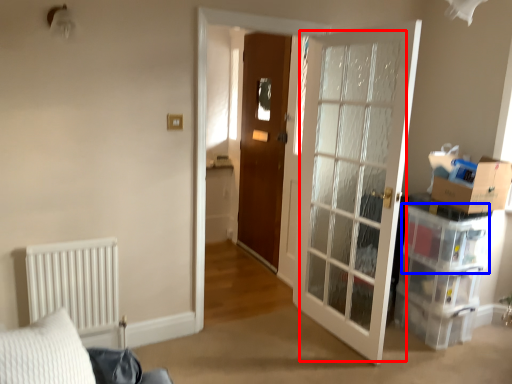
Question: Which object is further to the camera taking this photo, glass door (highlighted by a red box) or storage box (highlighted by a blue box)?

Choices:
 (A) glass door
 (B) storage box

Answer: (B)